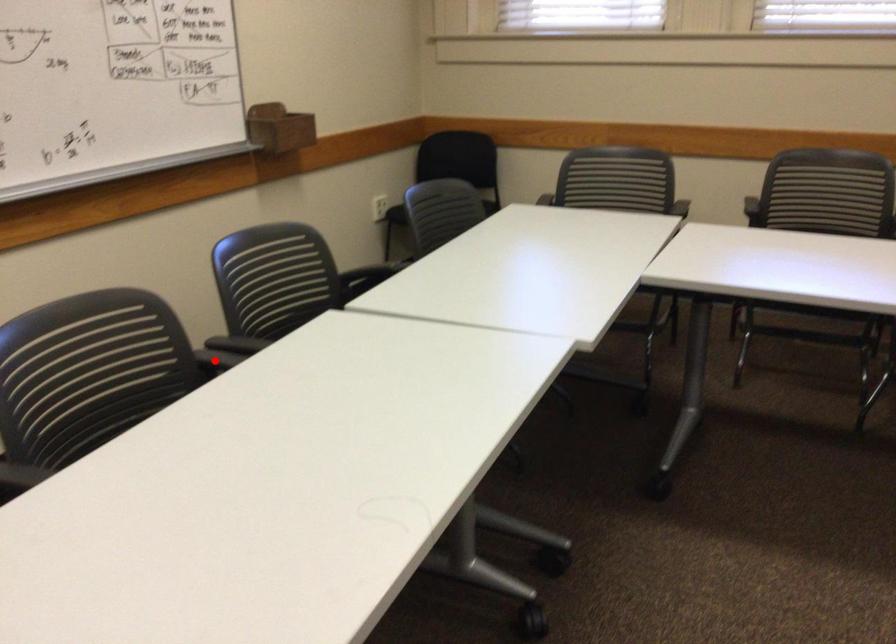
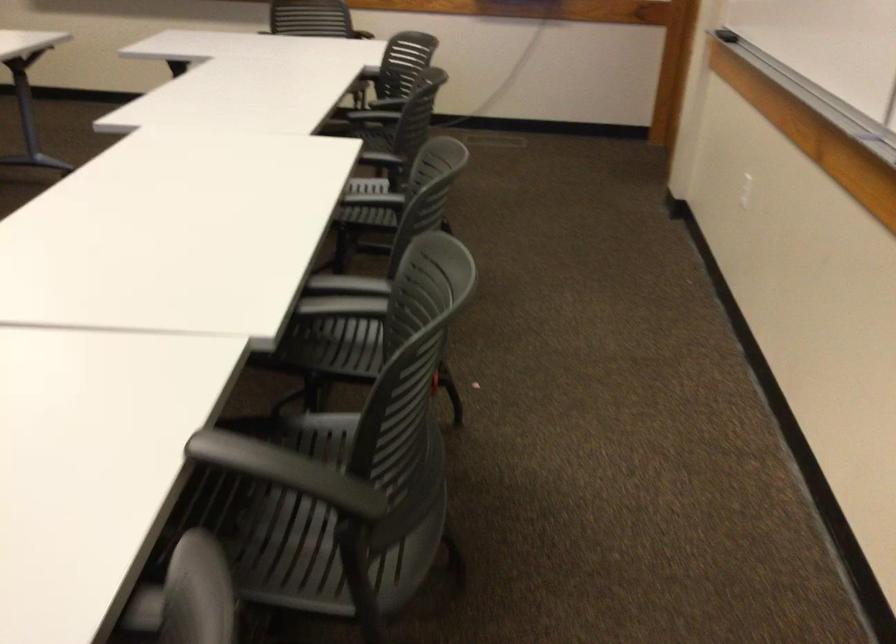
Locate, in the second image, the point that corresponds to the highlighted location in the first image.

(343, 297)